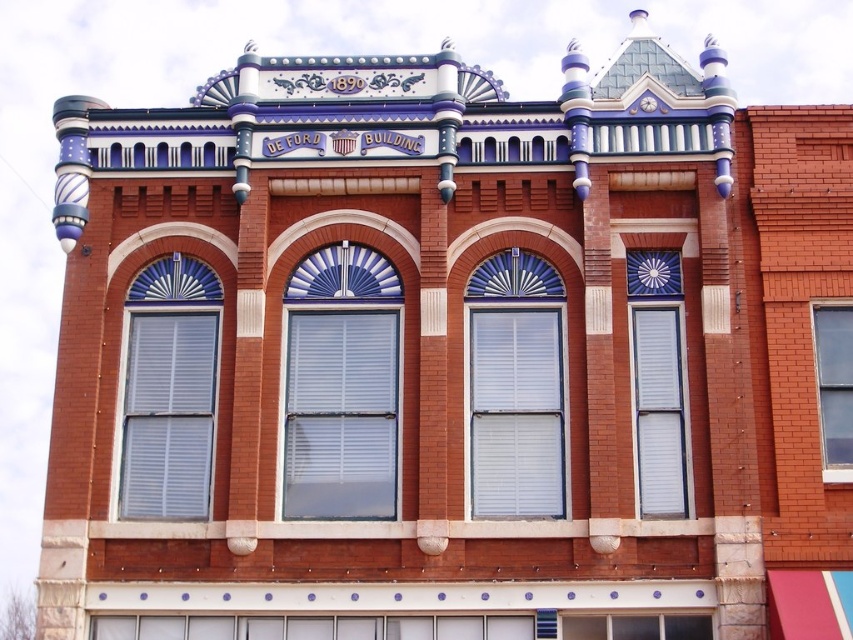
From the picture: You are a window cleaner with a ladder that can reach 20 feet. You need to clean both the blue glossy shutters at right and the clear glass window at lower center. Given their distance apart, can you reach both without moving the ladder?

The blue glossy shutters at right and clear glass window at lower center are 22.56 feet apart. Since your ladder can only reach 20 feet, you cannot reach both without moving the ladder.

From the picture: You are standing in front of the DeFord Building. There is a point marked at coordinates (657, 381) on the building. What object is located at this point?

The point at (657, 381) indicates the location of the blue glossy shutters at right.

You are an architect inspecting the DeFord Building. You notice the white textured shutters at center and the clear glass window at right. Which object is covering the other?

The white textured shutters at center is positioned over the clear glass window at right, so the shutters are covering the window.